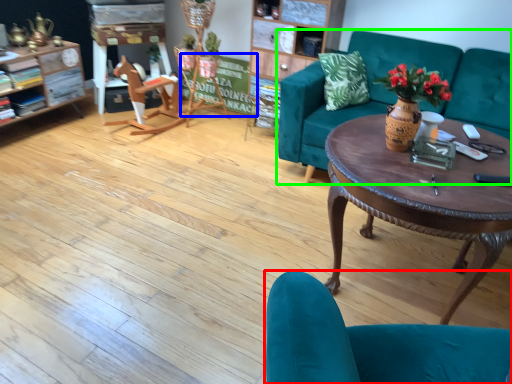
Question: Which object is the farthest from chair (highlighted by a red box)? Choose among these: bulletin board (highlighted by a blue box) or studio couch (highlighted by a green box).

Choices:
 (A) bulletin board
 (B) studio couch

Answer: (A)